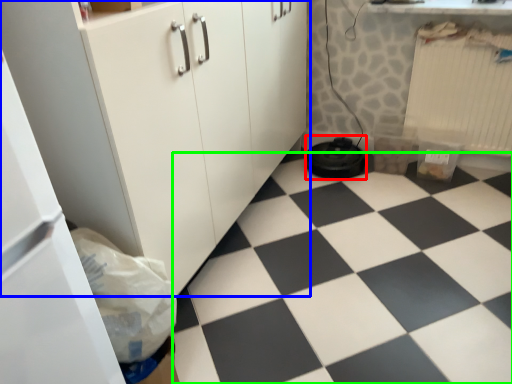
Question: Considering the real-world distances, which object is closest to water heater (highlighted by a red box)? cabinetry (highlighted by a blue box) or plain (highlighted by a green box).

Choices:
 (A) cabinetry
 (B) plain

Answer: (B)